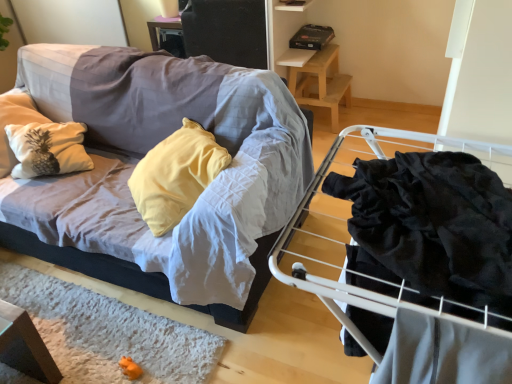
Question: From the image's perspective, is textured fabric couch at left located beneath black velvet fabric at right?

Choices:
 (A) yes
 (B) no

Answer: (B)

Question: Can you confirm if textured fabric couch at left is wider than black velvet fabric at right?

Choices:
 (A) no
 (B) yes

Answer: (B)

Question: Considering the relative positions of textured fabric couch at left and black velvet fabric at right in the image provided, is textured fabric couch at left to the right of black velvet fabric at right from the viewer's perspective?

Choices:
 (A) yes
 (B) no

Answer: (B)

Question: Is textured fabric couch at left not inside black velvet fabric at right?

Choices:
 (A) no
 (B) yes

Answer: (B)

Question: Is the position of textured fabric couch at left more distant than that of black velvet fabric at right?

Choices:
 (A) yes
 (B) no

Answer: (A)

Question: From the image's perspective, would you say textured fabric couch at left is positioned over black velvet fabric at right?

Choices:
 (A) yes
 (B) no

Answer: (A)

Question: Does wooden stool at upper right contain black velvet fabric at right?

Choices:
 (A) yes
 (B) no

Answer: (B)

Question: From the image's perspective, would you say wooden stool at upper right is positioned over black velvet fabric at right?

Choices:
 (A) yes
 (B) no

Answer: (A)

Question: Is wooden stool at upper right wider than black velvet fabric at right?

Choices:
 (A) yes
 (B) no

Answer: (B)

Question: Is wooden stool at upper right behind black velvet fabric at right?

Choices:
 (A) no
 (B) yes

Answer: (B)

Question: From a real-world perspective, is wooden stool at upper right physically below black velvet fabric at right?

Choices:
 (A) no
 (B) yes

Answer: (B)

Question: Considering the relative sizes of wooden stool at upper right and black velvet fabric at right in the image provided, is wooden stool at upper right smaller than black velvet fabric at right?

Choices:
 (A) yes
 (B) no

Answer: (B)

Question: From a real-world perspective, does textured fabric couch at left stand above wooden stool at upper right?

Choices:
 (A) yes
 (B) no

Answer: (A)